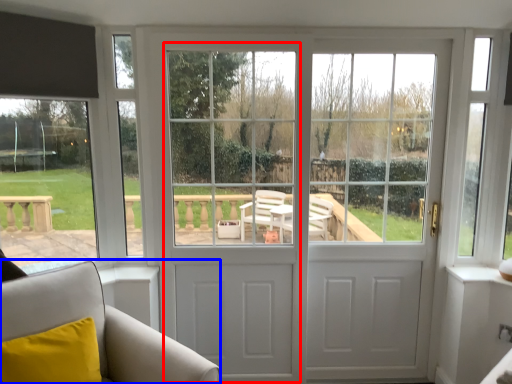
Question: Which of the following is the farthest to the observer, screen door (highlighted by a red box) or furniture (highlighted by a blue box)?

Choices:
 (A) screen door
 (B) furniture

Answer: (A)